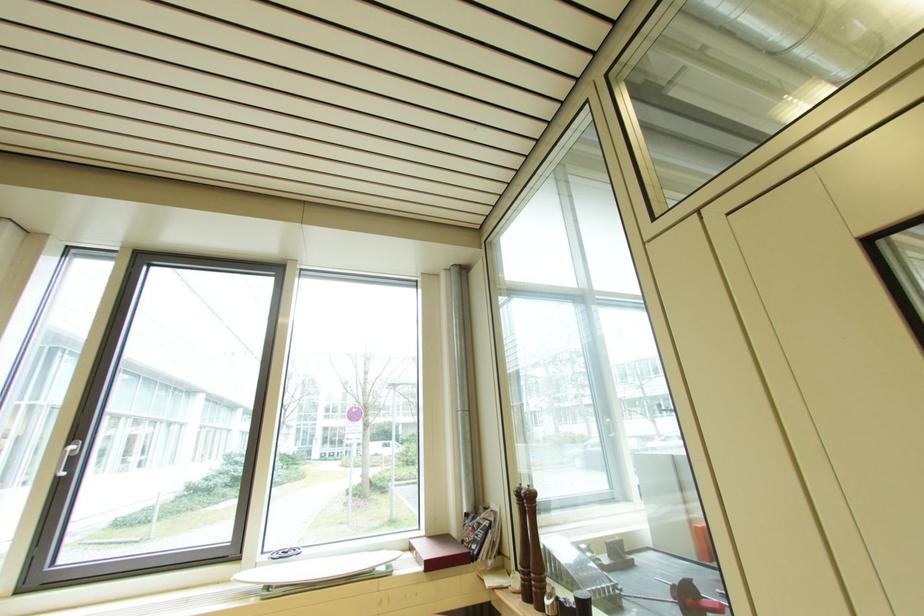
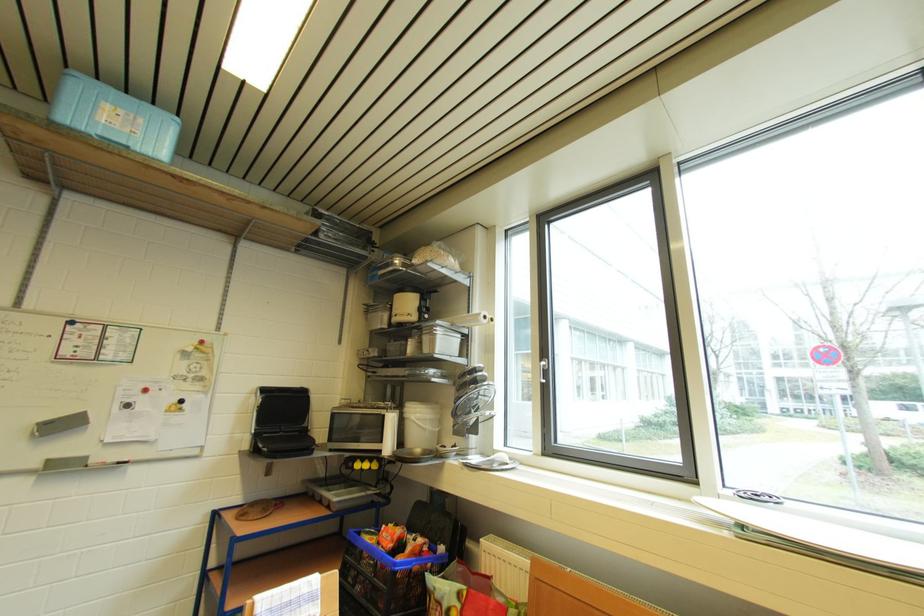
Question: Based on the continuous images, in which direction is the camera rotating? Reply with the corresponding letter.

Choices:
 (A) Left
 (B) Right
 (C) Up
 (D) Down

Answer: (A)